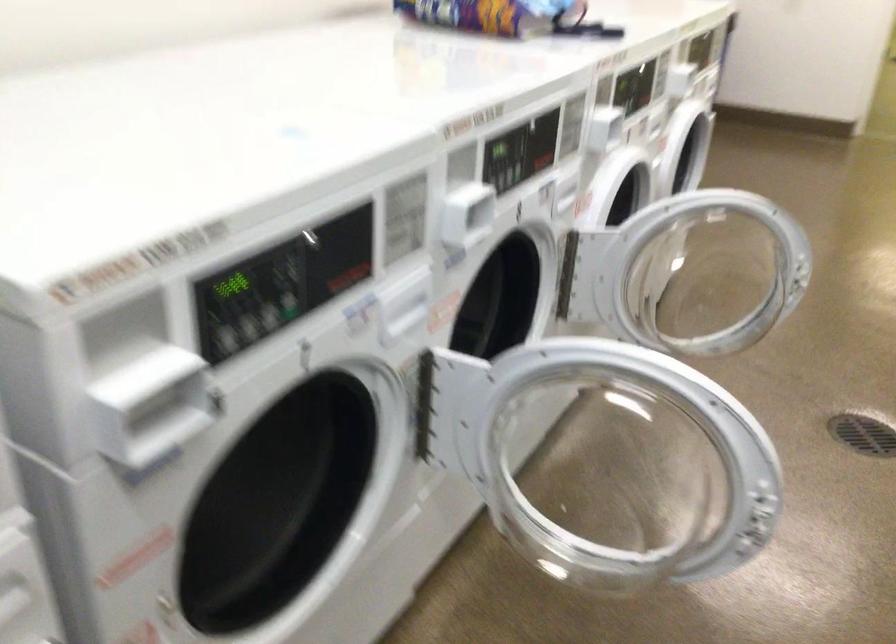
Question: How did the camera likely rotate?

Choices:
 (A) Left
 (B) Right
 (C) Up
 (D) Down

Answer: (A)